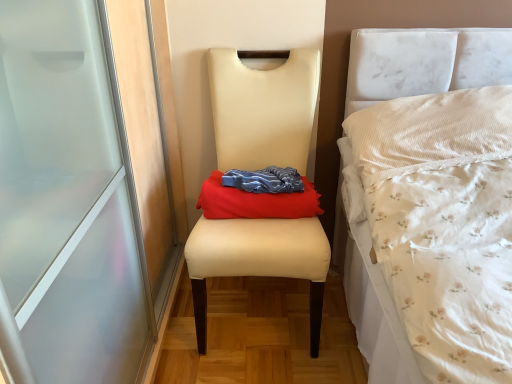
Question: Is matte cream chair at center taller or shorter than red fabric cloth at center?

Choices:
 (A) short
 (B) tall

Answer: (B)

Question: Relative to red fabric cloth at center, is matte cream chair at center in front or behind?

Choices:
 (A) behind
 (B) front

Answer: (B)

Question: In terms of size, does matte cream chair at center appear bigger or smaller than red fabric cloth at center?

Choices:
 (A) small
 (B) big

Answer: (B)

Question: Would you say red fabric cloth at center is to the left or to the right of matte cream chair at center in the picture?

Choices:
 (A) right
 (B) left

Answer: (A)

Question: From the image's perspective, is red fabric cloth at center located above or below matte cream chair at center?

Choices:
 (A) below
 (B) above

Answer: (B)

Question: In terms of height, does red fabric cloth at center look taller or shorter compared to matte cream chair at center?

Choices:
 (A) tall
 (B) short

Answer: (B)

Question: Is red fabric cloth at center in front of or behind matte cream chair at center in the image?

Choices:
 (A) front
 (B) behind

Answer: (B)